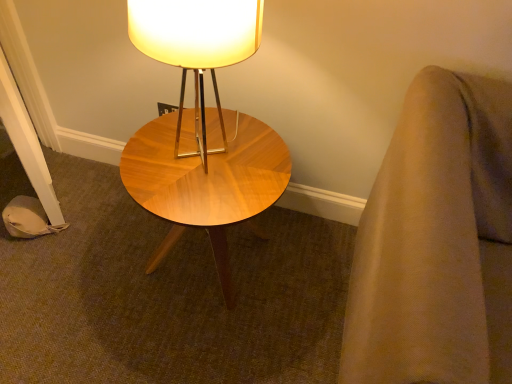
At what (x,y) coordinates should I click in order to perform the action: click on unoccupied area in front of woodenwoodencoffee table at center. Please return your answer as a coordinate pair (x, y). Looking at the image, I should click on (182, 345).